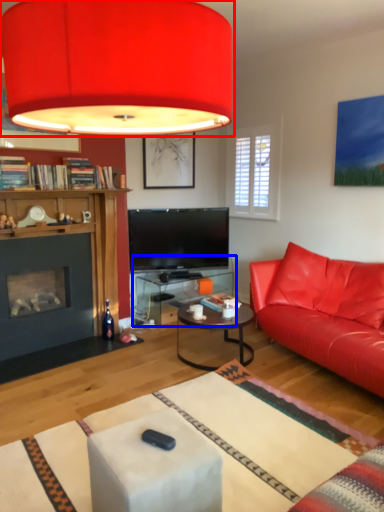
Question: Which point is further to the camera, lamp (highlighted by a red box) or table (highlighted by a blue box)?

Choices:
 (A) lamp
 (B) table

Answer: (B)